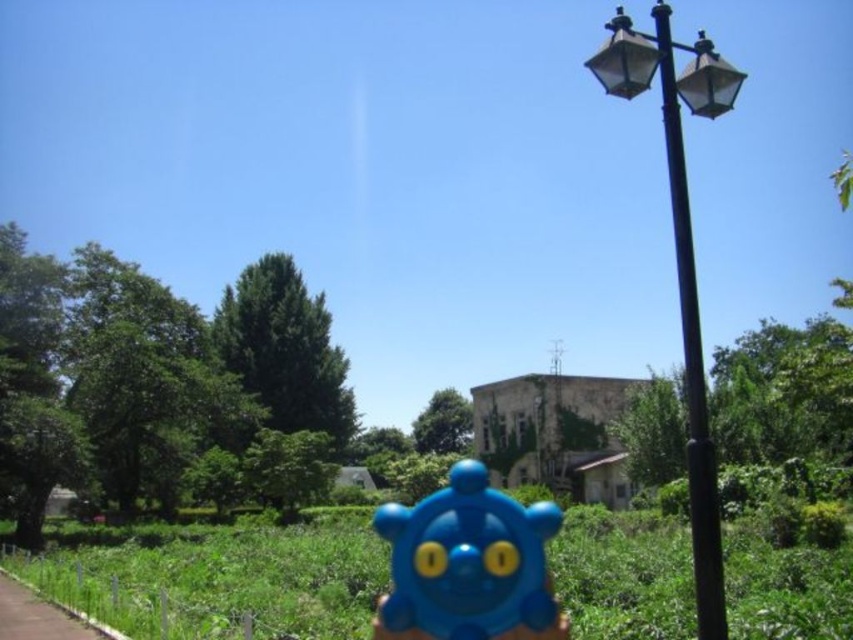
Can you confirm if black metal pole at right is positioned above brown asphalt pavement at lower left?

Correct, black metal pole at right is located above brown asphalt pavement at lower left.

Does black metal pole at right appear on the left side of brown asphalt pavement at lower left?

In fact, black metal pole at right is to the right of brown asphalt pavement at lower left.

Is point (708, 525) less distant than point (97, 627)?

Yes, it is.

Locate an element on the screen. The width and height of the screenshot is (853, 640). black metal pole at right is located at coordinates pyautogui.click(x=691, y=360).

Can you confirm if blue matte toy at center is thinner than brown asphalt pavement at lower left?

Yes, blue matte toy at center is thinner than brown asphalt pavement at lower left.

Measure the distance between point (537, 541) and camera.

Point (537, 541) and camera are 4.62 meters apart from each other.

The height and width of the screenshot is (640, 853). What are the coordinates of `blue matte toy at center` in the screenshot? It's located at (467, 560).

Looking at this image, can you confirm if blue matte toy at center is positioned above black metal pole at right?

No.

From the picture: Between blue matte toy at center and black metal pole at right, which one is positioned higher?

black metal pole at right is above.

Does point (479, 595) lie in front of point (701, 388)?

Yes, it is.

The image size is (853, 640). Identify the location of blue matte toy at center. (467, 560).